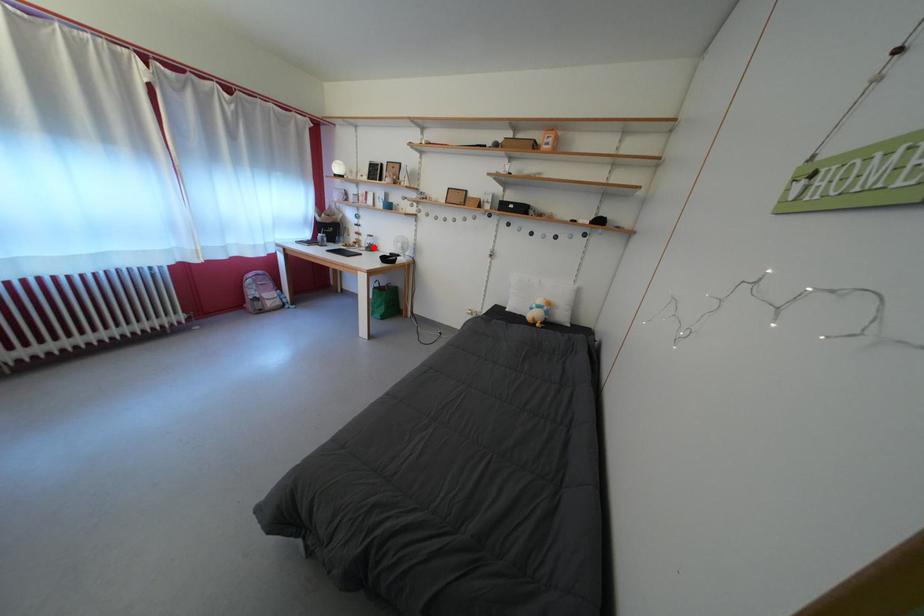
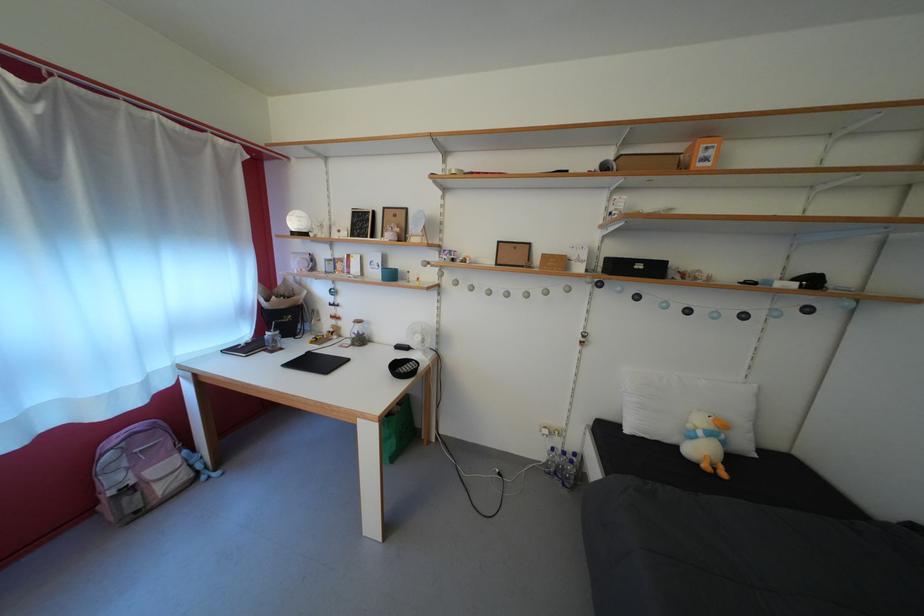
The point at the highlighted location is marked in the first image. Where is the corresponding point in the second image?

(358, 334)